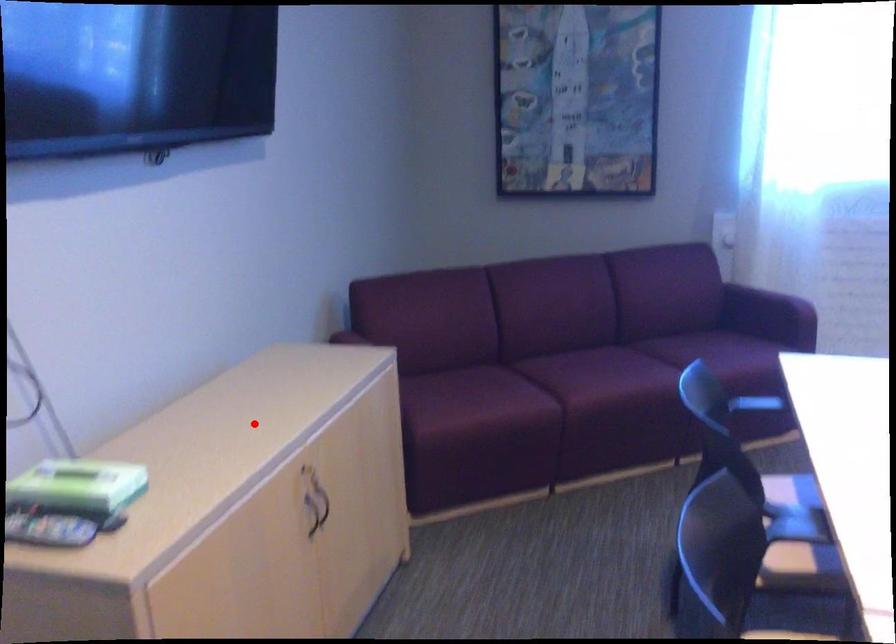
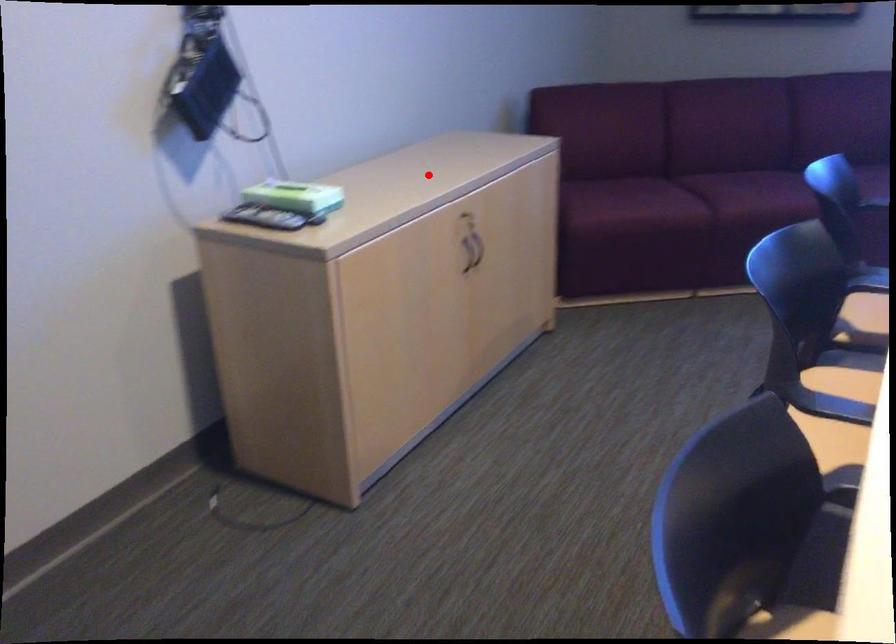
I am providing you with two images of the same scene from different viewpoints. A red point is marked on the first image and another point is marked on the second image. Is the marked point in image1 the same physical position as the marked point in image2?

Yes